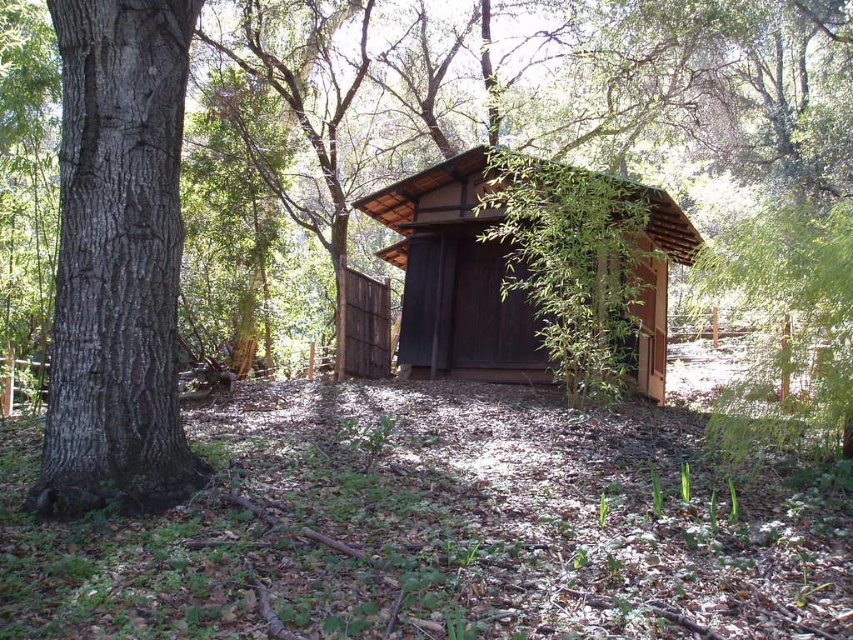
Question: Can you confirm if smooth brown bark at left is smaller than brown wooden cabin at center?

Choices:
 (A) yes
 (B) no

Answer: (A)

Question: From the image, what is the correct spatial relationship of smooth brown bark at left in relation to brown wooden cabin at center?

Choices:
 (A) above
 (B) below

Answer: (A)

Question: Which of the following is the closest to the observer?

Choices:
 (A) (469, 310)
 (B) (85, 28)

Answer: (B)

Question: Among these points, which one is farthest from the camera?

Choices:
 (A) (538, 348)
 (B) (59, 426)

Answer: (A)

Question: Where is smooth brown bark at left located in relation to brown wooden cabin at center in the image?

Choices:
 (A) left
 (B) right

Answer: (A)

Question: Which of the following is the farthest from the observer?

Choices:
 (A) smooth brown bark at left
 (B) brown wooden cabin at center

Answer: (B)